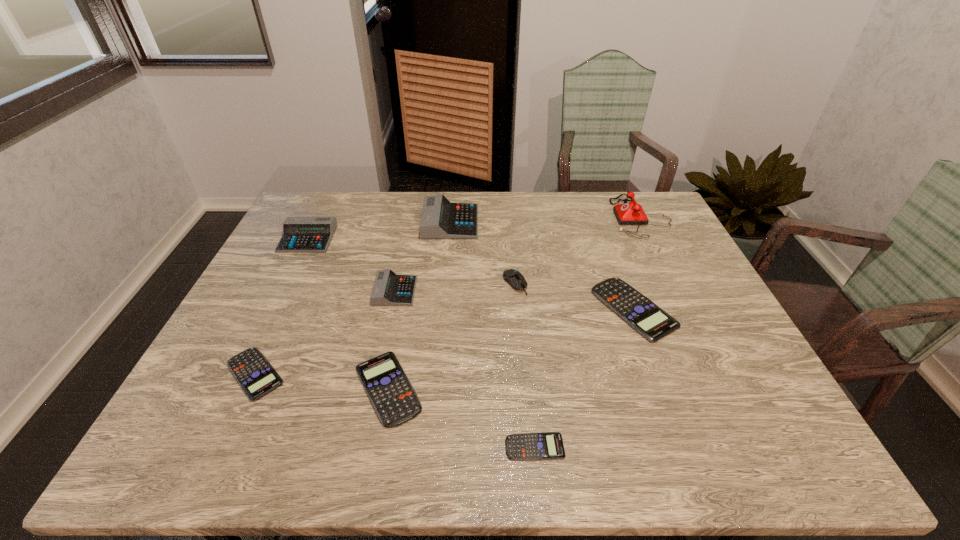
Locate an element on the screen. The height and width of the screenshot is (540, 960). telephone is located at coordinates (632, 213).

Locate an element on the screen. Image resolution: width=960 pixels, height=540 pixels. the tallest object is located at coordinates (632, 213).

I want to click on the biggest gray calculator, so click(x=440, y=219).

Locate an element on the screen. The image size is (960, 540). the eighth shortest object is located at coordinates (440, 219).

Image resolution: width=960 pixels, height=540 pixels. I want to click on the sixth shortest calculator, so click(x=299, y=234).

The width and height of the screenshot is (960, 540). Identify the location of the second smallest gray calculator. (299, 234).

Locate an element on the screen. the fifth shortest calculator is located at coordinates (389, 289).

This screenshot has width=960, height=540. I want to click on the smallest gray calculator, so click(389, 289).

The height and width of the screenshot is (540, 960). Identify the location of computer mouse. (513, 277).

The image size is (960, 540). Find the location of `the biggest blue calculator`. the biggest blue calculator is located at coordinates (653, 323).